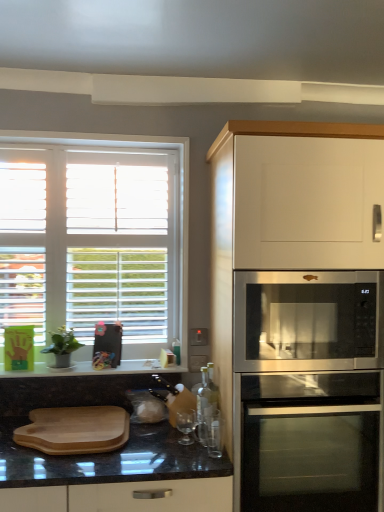
Question: Should I look upward or downward to see stainless steel microwave at right?

Choices:
 (A) up
 (B) down

Answer: (B)

Question: Is stainless steel oven at lower right facing towards granite black countertop at lower center?

Choices:
 (A) yes
 (B) no

Answer: (B)

Question: From the image's perspective, is stainless steel oven at lower right beneath granite black countertop at lower center?

Choices:
 (A) yes
 (B) no

Answer: (A)

Question: Is stainless steel oven at lower right facing away from granite black countertop at lower center?

Choices:
 (A) no
 (B) yes

Answer: (A)

Question: From a real-world perspective, is stainless steel oven at lower right below granite black countertop at lower center?

Choices:
 (A) no
 (B) yes

Answer: (B)

Question: Is stainless steel oven at lower right outside of granite black countertop at lower center?

Choices:
 (A) no
 (B) yes

Answer: (B)

Question: Considering the relative sizes of stainless steel oven at lower right and granite black countertop at lower center in the image provided, is stainless steel oven at lower right wider than granite black countertop at lower center?

Choices:
 (A) no
 (B) yes

Answer: (B)

Question: Would you consider stainless steel oven at lower right to be distant from white matte cabinet at upper right?

Choices:
 (A) yes
 (B) no

Answer: (B)

Question: Does stainless steel oven at lower right touch white matte cabinet at upper right?

Choices:
 (A) no
 (B) yes

Answer: (A)

Question: Could you tell me if stainless steel oven at lower right is turned towards white matte cabinet at upper right?

Choices:
 (A) no
 (B) yes

Answer: (B)

Question: Considering the relative positions of stainless steel oven at lower right and white matte cabinet at upper right in the image provided, is stainless steel oven at lower right to the left of white matte cabinet at upper right from the viewer's perspective?

Choices:
 (A) no
 (B) yes

Answer: (B)

Question: Can you confirm if stainless steel oven at lower right is smaller than white matte cabinet at upper right?

Choices:
 (A) yes
 (B) no

Answer: (A)

Question: Is stainless steel oven at lower right completely or partially outside of white matte cabinet at upper right?

Choices:
 (A) yes
 (B) no

Answer: (B)

Question: Does wooden cutting board at lower left have a smaller size compared to stainless steel microwave at right?

Choices:
 (A) yes
 (B) no

Answer: (A)